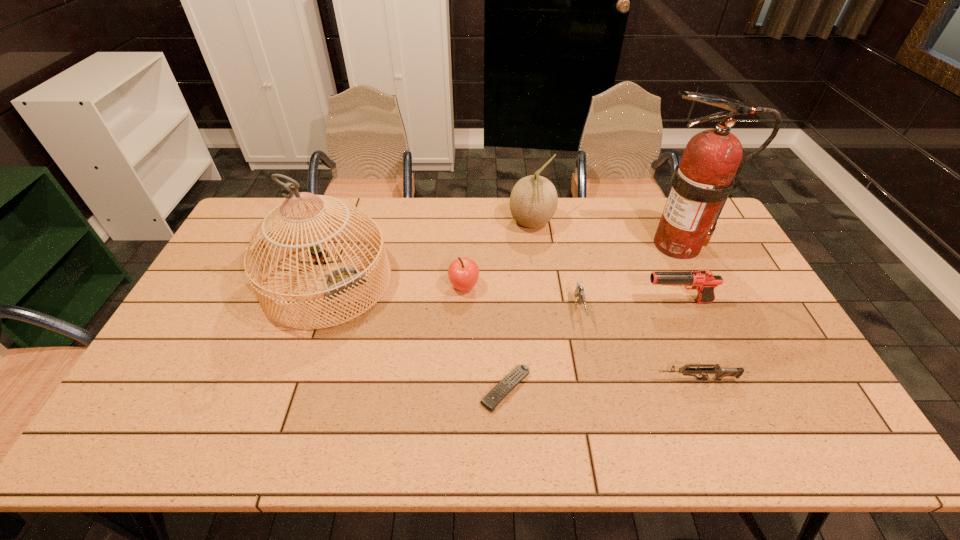
The image size is (960, 540). I want to click on free space located 0.280m at the nozzle of the fire extinguisher, so click(x=551, y=245).

The height and width of the screenshot is (540, 960). I want to click on free space located at the nozzle of the fire extinguisher, so click(612, 245).

The image size is (960, 540). I want to click on free location located 0.080m at the nozzle of the fire extinguisher, so click(x=610, y=245).

At what (x,y) coordinates should I click in order to perform the action: click on free space located on the front of the seventh shortest object. Please return your answer as a coordinate pair (x, y). Looking at the image, I should click on (276, 426).

In order to click on free spot located 0.230m on the right of the sixth shortest object in this screenshot , I will do click(618, 224).

Locate an element on the screen. vacant area located 0.110m at the aiming end of the tallest gun is located at coordinates (607, 302).

Identify the location of free region located at the aiming end of the tallest gun. The image size is (960, 540). (603, 302).

Find the location of `vacant space located 0.310m at the aiming end of the tallest gun`. vacant space located 0.310m at the aiming end of the tallest gun is located at coordinates (540, 302).

Locate an element on the screen. This screenshot has width=960, height=540. free space located on the right of the second object from left to right is located at coordinates (587, 287).

Locate an element on the screen. This screenshot has height=540, width=960. free space located 0.060m at the barrel of the fourth object from right to left is located at coordinates (587, 349).